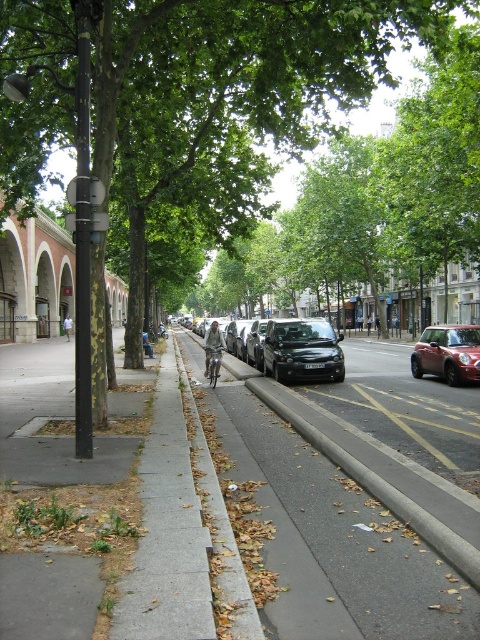
Between metallic red car at right and gray fabric jacket at center, which one appears on the right side from the viewer's perspective?

metallic red car at right

Is metallic red car at right to the right of gray fabric jacket at center from the viewer's perspective?

Yes, metallic red car at right is to the right of gray fabric jacket at center.

Find the location of a particular element. metallic red car at right is located at coordinates (447, 353).

At what (x,y) coordinates should I click in order to perform the action: click on metallic red car at right. Please return your answer as a coordinate pair (x, y). The image size is (480, 640). Looking at the image, I should click on (447, 353).

Is point (218, 349) farther from viewer compared to point (64, 317)?

No, (218, 349) is closer to viewer.

In the scene shown: Which of these two, metallic silver bike at center or khaki cotton shorts at center, stands shorter?

With less height is metallic silver bike at center.

The height and width of the screenshot is (640, 480). I want to click on metallic silver bike at center, so click(213, 364).

Which of these two, metallic red car at right or metallic silver bike at center, stands shorter?

With less height is metallic silver bike at center.

Is point (466, 372) less distant than point (214, 365)?

Yes, it is in front of point (214, 365).

Image resolution: width=480 pixels, height=640 pixels. Describe the element at coordinates (447, 353) in the screenshot. I see `metallic red car at right` at that location.

Locate an element on the screen. The width and height of the screenshot is (480, 640). metallic red car at right is located at coordinates (447, 353).